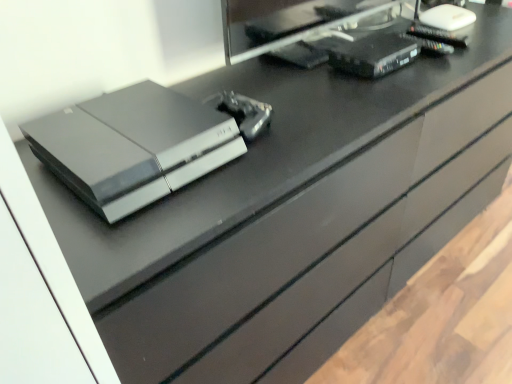
Locate an element on the screen. free area in between metallic silver controller at center, which is counted as the first equipment, starting from the front, and black plastic router at upper right, which ranks as the second equipment in front-to-back order is located at coordinates (311, 91).